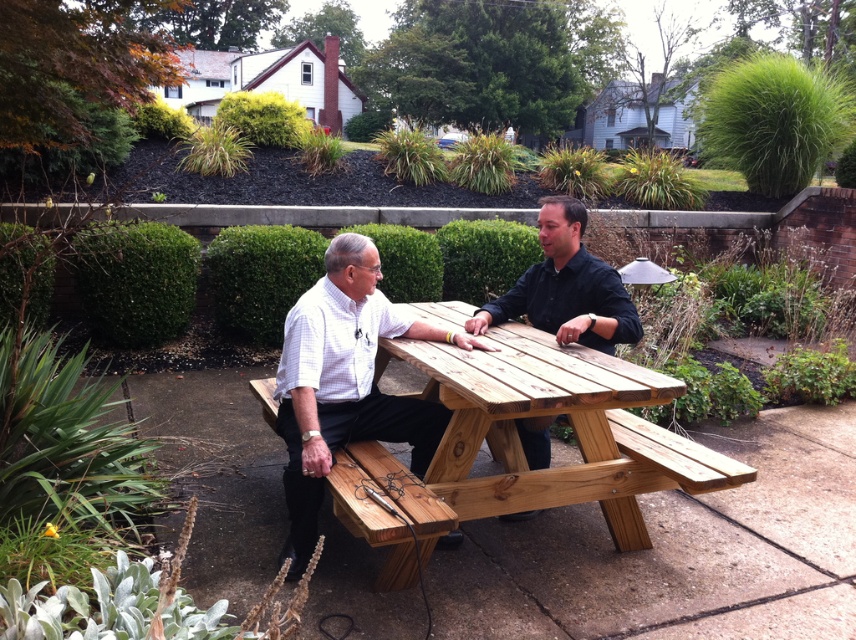
Question: Which point is closer to the camera taking this photo?

Choices:
 (A) (563, 476)
 (B) (484, 330)
 (C) (325, 376)
 (D) (336, 506)

Answer: (D)

Question: Which object appears closest to the camera in this image?

Choices:
 (A) light brown wood picnic table at center
 (B) natural wood picnic table at center
 (C) wooden picnic table at center

Answer: (B)

Question: Which point appears closest to the camera in this image?

Choices:
 (A) (382, 524)
 (B) (296, 472)
 (C) (473, 499)

Answer: (A)

Question: Is natural wood picnic table at center positioned before light brown wood picnic table at center?

Choices:
 (A) no
 (B) yes

Answer: (B)

Question: Can you confirm if wooden picnic table at center is bigger than natural wood park bench at center?

Choices:
 (A) no
 (B) yes

Answer: (B)

Question: Does light brown wood picnic table at center have a larger size compared to wooden picnic table at center?

Choices:
 (A) no
 (B) yes

Answer: (B)